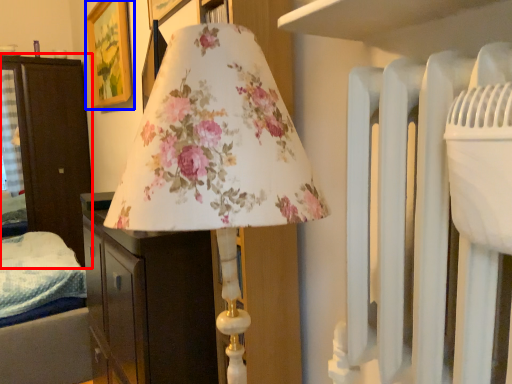
Question: Which object appears farthest to the camera in this image, furniture (highlighted by a red box) or picture frame (highlighted by a blue box)?

Choices:
 (A) furniture
 (B) picture frame

Answer: (A)